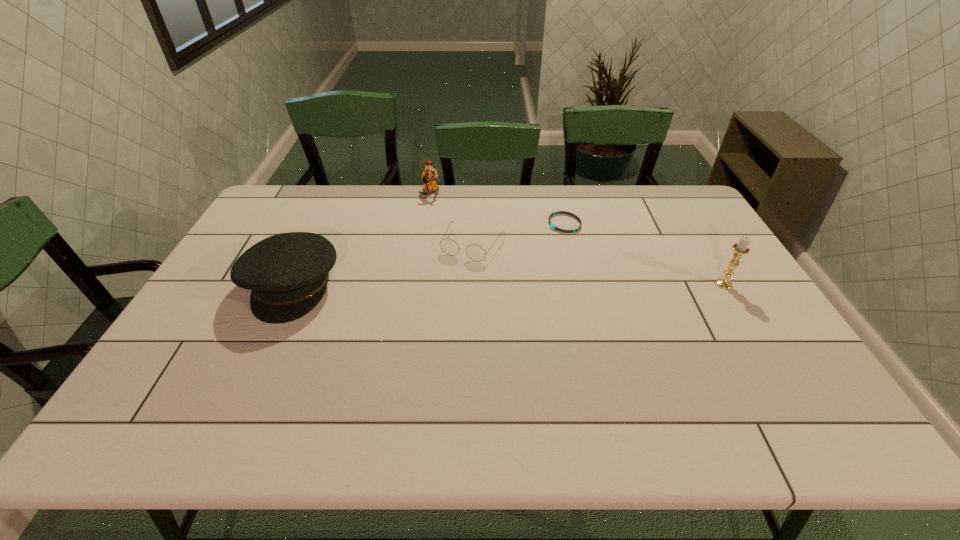
Find the location of a particular element. beret is located at coordinates (287, 273).

The height and width of the screenshot is (540, 960). I want to click on candle holder, so click(x=741, y=248).

At what (x,y) coordinates should I click in order to perform the action: click on the rightmost object. Please return your answer as a coordinate pair (x, y). Image resolution: width=960 pixels, height=540 pixels. Looking at the image, I should click on (741, 248).

Identify the location of the shortest object. The image size is (960, 540). (552, 225).

This screenshot has width=960, height=540. I want to click on wristband, so click(552, 225).

Image resolution: width=960 pixels, height=540 pixels. I want to click on spectacles, so click(x=475, y=252).

Identify the location of the third object from left to right. (475, 252).

Locate an element on the screen. The image size is (960, 540). the fourth object from right to left is located at coordinates (429, 175).

Identify the location of the farthest object. (429, 175).

I want to click on vacant space positioned 0.190m on the front-facing side of the leftmost object, so click(248, 385).